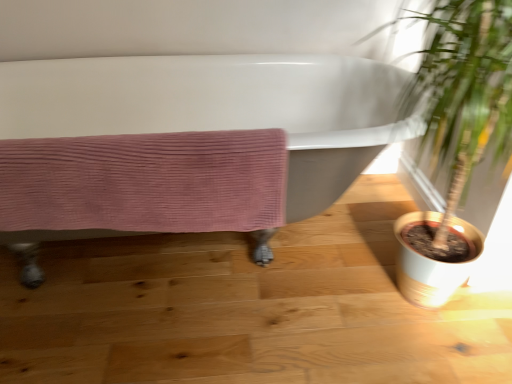
Question: Considering the relative sizes of white glossy bathtub at center and pink corduroy towel at lower left in the image provided, is white glossy bathtub at center smaller than pink corduroy towel at lower left?

Choices:
 (A) no
 (B) yes

Answer: (A)

Question: Considering the relative positions of white glossy bathtub at center and pink corduroy towel at lower left in the image provided, is white glossy bathtub at center in front of pink corduroy towel at lower left?

Choices:
 (A) yes
 (B) no

Answer: (A)

Question: Is white glossy bathtub at center wider than pink corduroy towel at lower left?

Choices:
 (A) yes
 (B) no

Answer: (A)

Question: Is white glossy bathtub at center not near pink corduroy towel at lower left?

Choices:
 (A) no
 (B) yes

Answer: (A)

Question: Is white glossy bathtub at center taller than pink corduroy towel at lower left?

Choices:
 (A) no
 (B) yes

Answer: (B)

Question: Could pink corduroy towel at lower left be considered to be inside white glossy bathtub at center?

Choices:
 (A) yes
 (B) no

Answer: (A)

Question: From the image's perspective, is pink corduroy towel at lower left located beneath green leafy plant at right?

Choices:
 (A) no
 (B) yes

Answer: (B)

Question: Are pink corduroy towel at lower left and green leafy plant at right far apart?

Choices:
 (A) yes
 (B) no

Answer: (B)

Question: From a real-world perspective, is pink corduroy towel at lower left located beneath green leafy plant at right?

Choices:
 (A) yes
 (B) no

Answer: (A)

Question: Can you confirm if pink corduroy towel at lower left is thinner than green leafy plant at right?

Choices:
 (A) no
 (B) yes

Answer: (B)

Question: Are pink corduroy towel at lower left and green leafy plant at right beside each other?

Choices:
 (A) yes
 (B) no

Answer: (B)

Question: From the image's perspective, is pink corduroy towel at lower left located above green leafy plant at right?

Choices:
 (A) yes
 (B) no

Answer: (B)

Question: From the image's perspective, would you say green leafy plant at right is shown under pink corduroy towel at lower left?

Choices:
 (A) yes
 (B) no

Answer: (B)